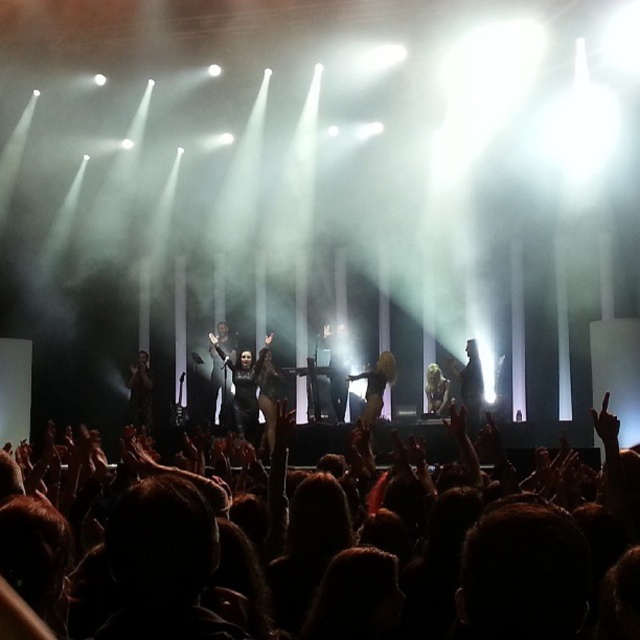
Can you confirm if silvery metallic jacket at center is bigger than matte black dress at lower left?

No.

Does silvery metallic jacket at center have a smaller size compared to matte black dress at lower left?

Yes, silvery metallic jacket at center is smaller than matte black dress at lower left.

Image resolution: width=640 pixels, height=640 pixels. What do you see at coordinates (470, 385) in the screenshot?
I see `silvery metallic jacket at center` at bounding box center [470, 385].

I want to click on silvery metallic jacket at center, so click(470, 385).

Can you confirm if silvery metallic jacket at center is shorter than satin gold dress at center?

No.

Is point (476, 403) farther from camera compared to point (362, 372)?

That is False.

The height and width of the screenshot is (640, 640). What are the coordinates of `silvery metallic jacket at center` in the screenshot? It's located at (470, 385).

Measure the distance from matte black dress at center to matte black dress at lower left.

They are 9.55 feet apart.

Is matte black dress at center to the right of matte black dress at lower left from the viewer's perspective?

Indeed, matte black dress at center is positioned on the right side of matte black dress at lower left.

Locate an element on the screen. The image size is (640, 640). matte black dress at center is located at coordinates (220, 372).